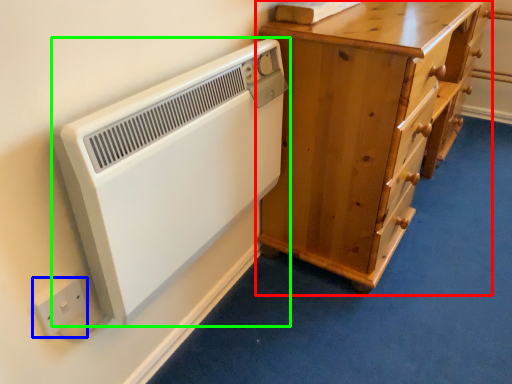
Question: Which is nearer to the chest of drawers (highlighted by a red box)? electric outlet (highlighted by a blue box) or home appliance (highlighted by a green box).

Choices:
 (A) electric outlet
 (B) home appliance

Answer: (B)